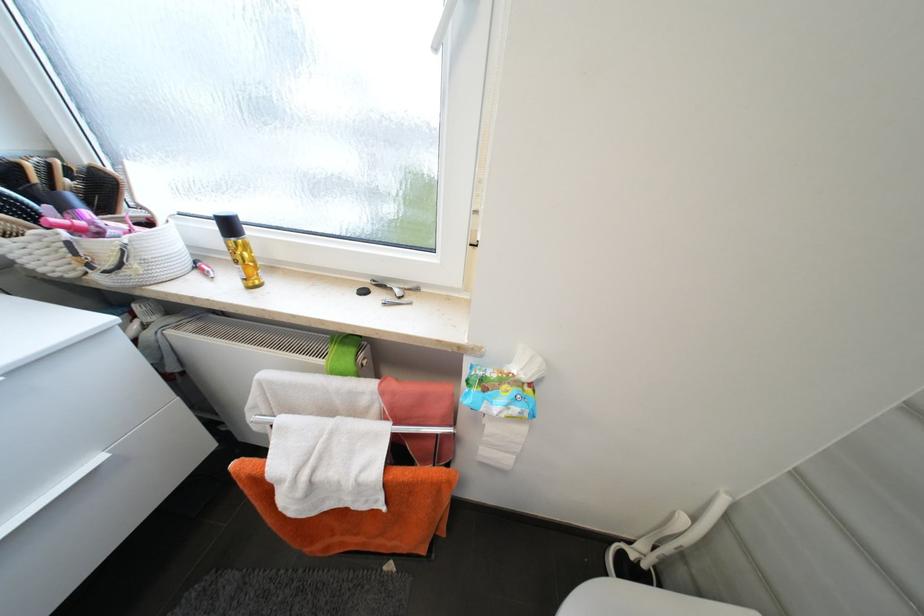
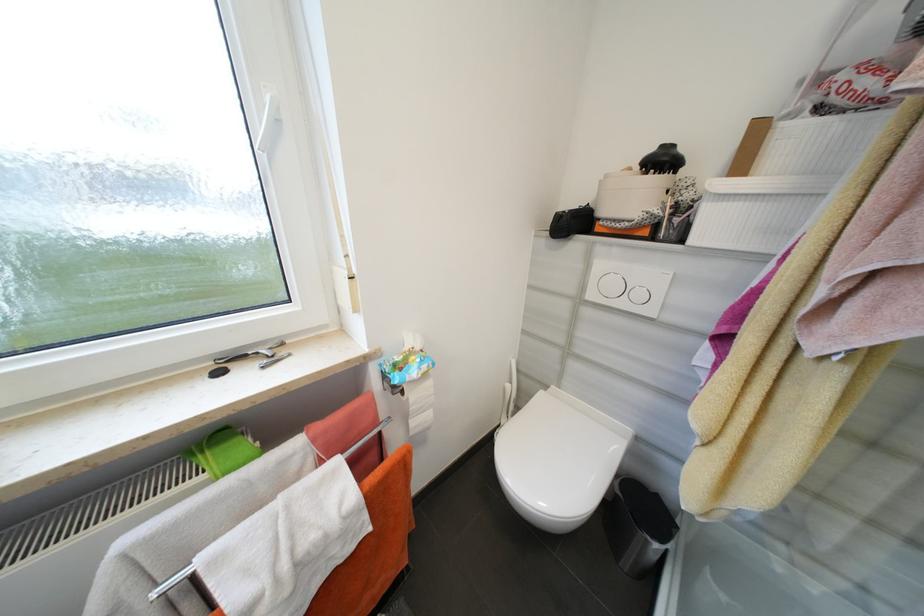
Where in the second image is the point corresponding to point 397,290 from the first image?

(262, 354)